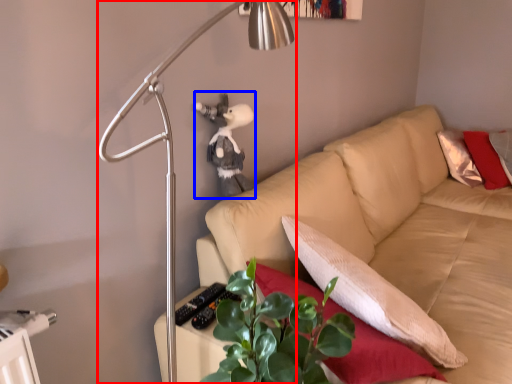
Question: Which of the following is the farthest to the observer, lamp (highlighted by a red box) or figurine (highlighted by a blue box)?

Choices:
 (A) lamp
 (B) figurine

Answer: (B)